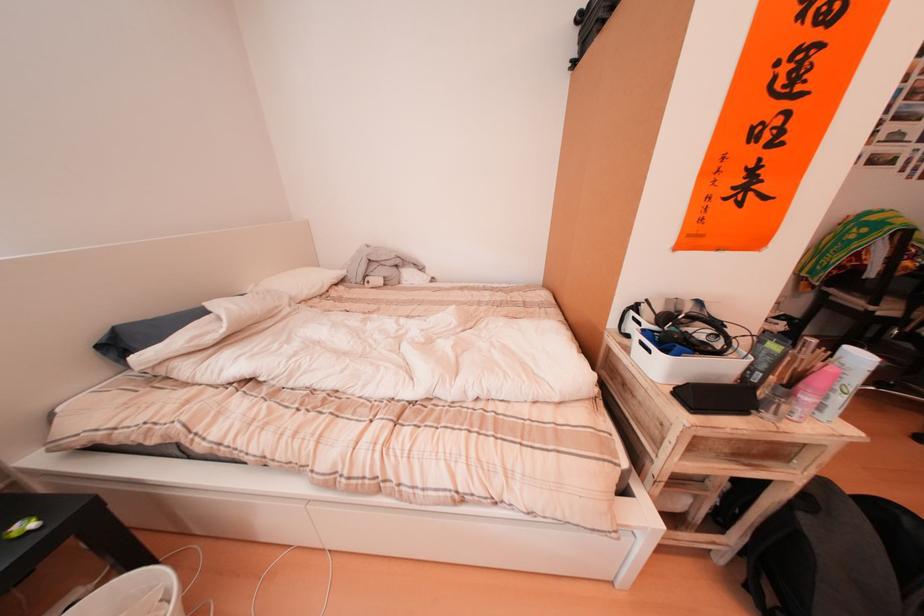
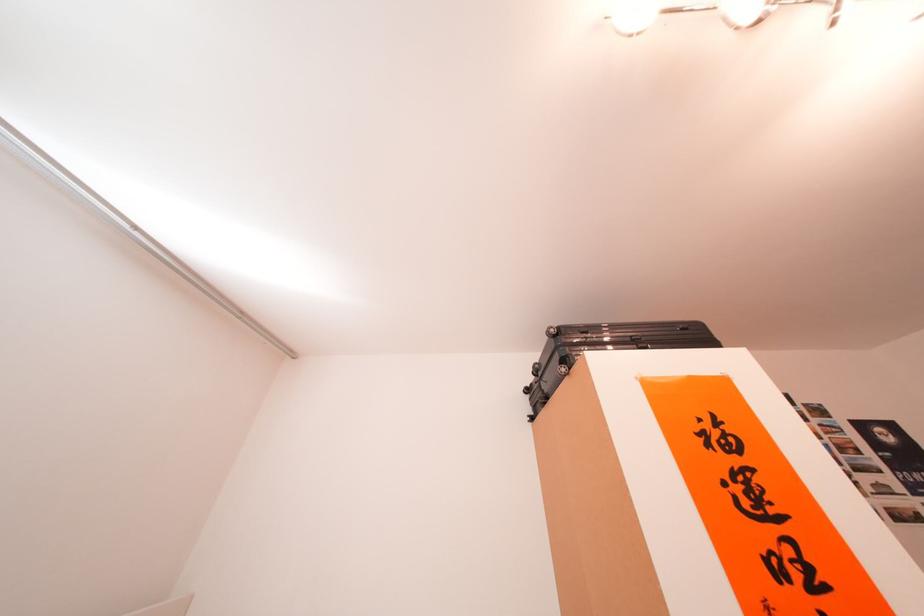
Question: How did the camera likely rotate?

Choices:
 (A) Left
 (B) Right
 (C) Up
 (D) Down

Answer: (C)